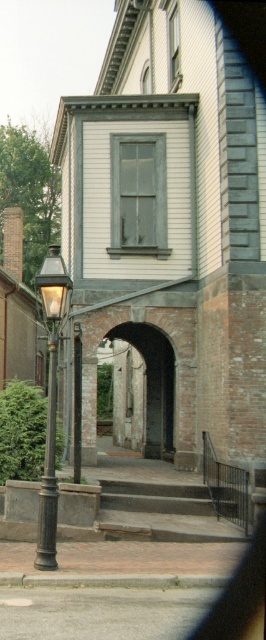
Question: Which object appears farthest from the camera in this image?

Choices:
 (A) polished brass streetlamp at left
 (B) teal glass window at center
 (C) clear glass window at upper center

Answer: (C)

Question: Considering the relative positions of teal glass window at center and polished brass streetlamp at left in the image provided, where is teal glass window at center located with respect to polished brass streetlamp at left?

Choices:
 (A) right
 (B) left

Answer: (A)

Question: Does polished brass streetlamp at left have a larger size compared to clear glass window at upper center?

Choices:
 (A) no
 (B) yes

Answer: (B)

Question: Which is nearer to the polished brass streetlamp at left?

Choices:
 (A) teal glass window at center
 (B) clear glass window at upper center

Answer: (A)

Question: Can you confirm if teal glass window at center is bigger than polished brass streetlamp at left?

Choices:
 (A) yes
 (B) no

Answer: (B)

Question: Which is nearer to the polished brass streetlamp at left?

Choices:
 (A) clear glass window at upper center
 (B) teal glass window at center

Answer: (B)